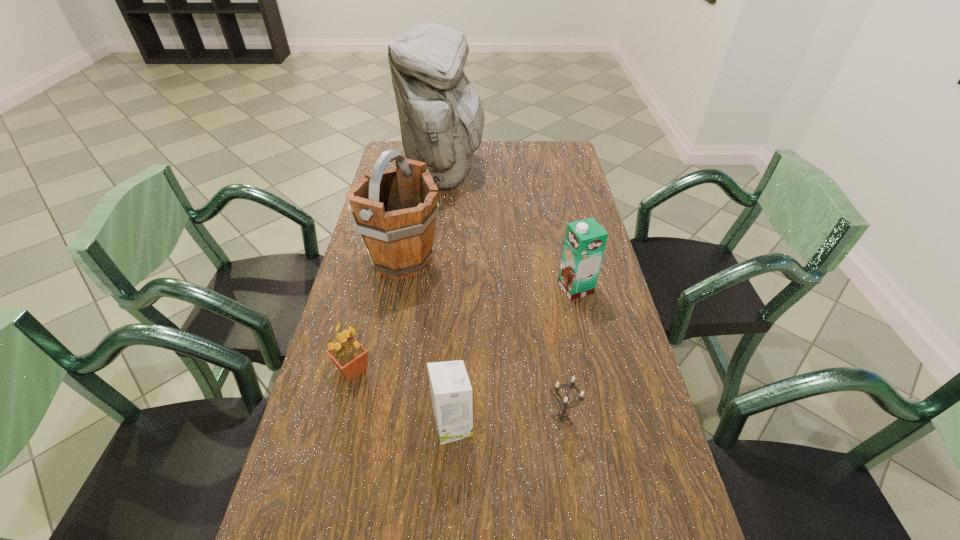
This screenshot has width=960, height=540. Identify the location of the second object from right to left. (562, 415).

Find the location of `vacant space located on the front-facing side of the tallest object`. vacant space located on the front-facing side of the tallest object is located at coordinates (579, 173).

Where is `vacant area situated on the front of the fifth shortest object`? Image resolution: width=960 pixels, height=540 pixels. vacant area situated on the front of the fifth shortest object is located at coordinates (388, 335).

Find the location of a particular element. This screenshot has width=960, height=540. vacant space situated on the back of the right carton is located at coordinates (565, 242).

The width and height of the screenshot is (960, 540). Find the location of `free location located on the right of the left carton`. free location located on the right of the left carton is located at coordinates click(618, 426).

At what (x,y) coordinates should I click in order to perform the action: click on free location located at the front of the third nearest object with flowers visible. Please return your answer as a coordinate pair (x, y). Image resolution: width=960 pixels, height=540 pixels. Looking at the image, I should click on [455, 369].

Image resolution: width=960 pixels, height=540 pixels. I want to click on vacant area situated 0.060m on the front of the shortest object, so click(x=568, y=460).

This screenshot has width=960, height=540. Identify the location of object positioned at the far edge. (441, 116).

This screenshot has height=540, width=960. In order to click on backpack that is at the left edge in this screenshot , I will do `click(441, 116)`.

The height and width of the screenshot is (540, 960). I want to click on bucket that is at the left edge, so click(x=394, y=210).